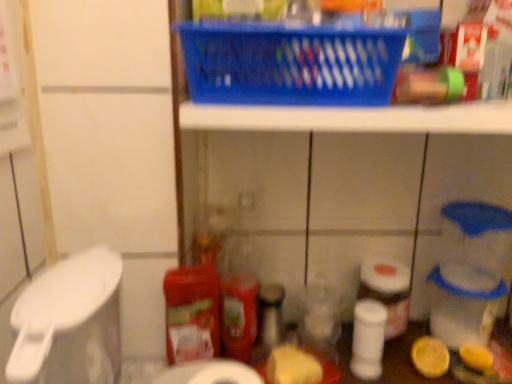
Question: Is white matte toilet paper at lower right, the third toilet paper viewed from the front, turned away from white matte toilet paper at lower center, positioned as the first toilet paper in left-to-right order?

Choices:
 (A) yes
 (B) no

Answer: (B)

Question: Considering the relative sizes of white matte toilet paper at lower right, the third toilet paper viewed from the front, and white matte toilet paper at lower center, placed as the 3th toilet paper when sorted from right to left, in the image provided, is white matte toilet paper at lower right, the third toilet paper viewed from the front, thinner than white matte toilet paper at lower center, placed as the 3th toilet paper when sorted from right to left,?

Choices:
 (A) yes
 (B) no

Answer: (A)

Question: From a real-world perspective, is white matte toilet paper at lower right, which is the 3th toilet paper from left to right, on white matte toilet paper at lower center, placed as the 3th toilet paper when sorted from right to left?

Choices:
 (A) yes
 (B) no

Answer: (B)

Question: Can you confirm if white matte toilet paper at lower right, the first toilet paper from the right, is shorter than white matte toilet paper at lower center, arranged as the 1th toilet paper when viewed from the front?

Choices:
 (A) no
 (B) yes

Answer: (B)

Question: From the image's perspective, does white matte toilet paper at lower right, which is the 3th toilet paper from left to right, appear lower than white matte toilet paper at lower center, arranged as the 1th toilet paper when viewed from the front?

Choices:
 (A) no
 (B) yes

Answer: (A)

Question: Considering the positions of yellow matte lemon at lower right and white matte toilet paper at center, positioned as the 2th toilet paper in left-to-right order, in the image, is yellow matte lemon at lower right taller or shorter than white matte toilet paper at center, positioned as the 2th toilet paper in left-to-right order,?

Choices:
 (A) tall
 (B) short

Answer: (B)

Question: In the image, is yellow matte lemon at lower right positioned in front of or behind white matte toilet paper at center, positioned as the 2th toilet paper in left-to-right order?

Choices:
 (A) front
 (B) behind

Answer: (B)

Question: Considering the positions of point (419, 337) and point (375, 334), is point (419, 337) closer or farther from the camera than point (375, 334)?

Choices:
 (A) farther
 (B) closer

Answer: (A)

Question: Looking at their shapes, would you say yellow matte lemon at lower right is wider or thinner than white matte toilet paper at center, which is the 2th toilet paper from back to front?

Choices:
 (A) thin
 (B) wide

Answer: (A)

Question: Relative to matte red plastic bottle at center, is white matte toilet paper at lower center, placed as the 3th toilet paper when sorted from right to left, in front or behind?

Choices:
 (A) behind
 (B) front

Answer: (B)

Question: Considering the positions of point (231, 367) and point (224, 281), is point (231, 367) closer or farther from the camera than point (224, 281)?

Choices:
 (A) closer
 (B) farther

Answer: (A)

Question: From the image's perspective, is white matte toilet paper at lower center, arranged as the third toilet paper when viewed from the back, positioned above or below matte red plastic bottle at center?

Choices:
 (A) above
 (B) below

Answer: (B)

Question: From their relative heights in the image, would you say white matte toilet paper at lower center, positioned as the first toilet paper in left-to-right order, is taller or shorter than matte red plastic bottle at center?

Choices:
 (A) tall
 (B) short

Answer: (B)

Question: From the image's perspective, is white matte toilet paper at center, the second toilet paper positioned from the front, positioned above or below white matte toilet paper at lower right, the third toilet paper viewed from the front?

Choices:
 (A) above
 (B) below

Answer: (A)

Question: In the image, is white matte toilet paper at center, which is the 2th toilet paper from back to front, on the left side or the right side of white matte toilet paper at lower right, which is the 3th toilet paper from left to right?

Choices:
 (A) right
 (B) left

Answer: (B)